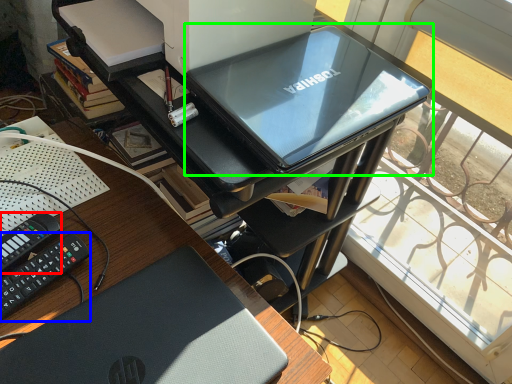
Question: Which is farther away from equipment (highlighted by a red box)? equipment (highlighted by a blue box) or computer (highlighted by a green box)?

Choices:
 (A) equipment
 (B) computer

Answer: (B)